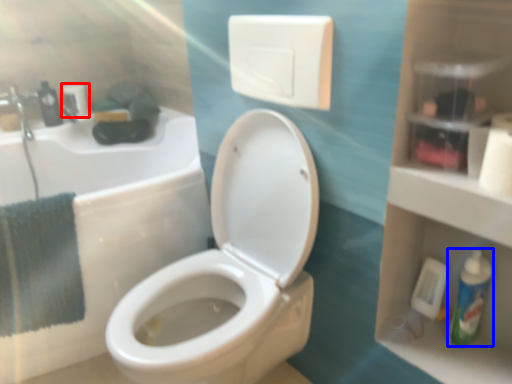
Question: Which of the following is the closest to the observer, toilet paper (highlighted by a red box) or mouthwash (highlighted by a blue box)?

Choices:
 (A) toilet paper
 (B) mouthwash

Answer: (B)